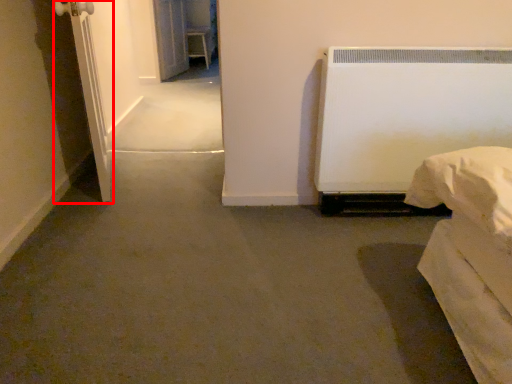
Question: Considering the relative positions of screen door (annotated by the red box) and screen door in the image provided, where is screen door (annotated by the red box) located with respect to the staircase?

Choices:
 (A) left
 (B) right

Answer: (B)